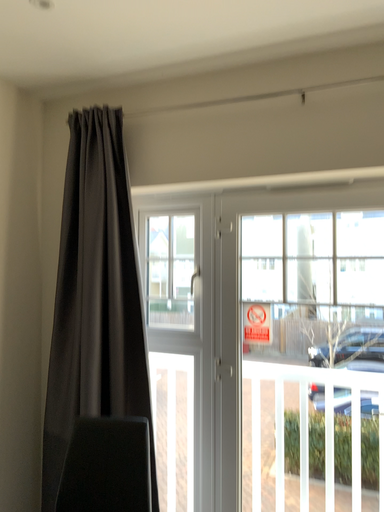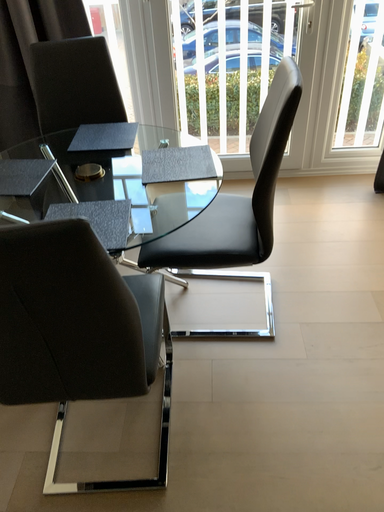
Question: Which way did the camera rotate in the video?

Choices:
 (A) rotated downward
 (B) rotated upward

Answer: (A)